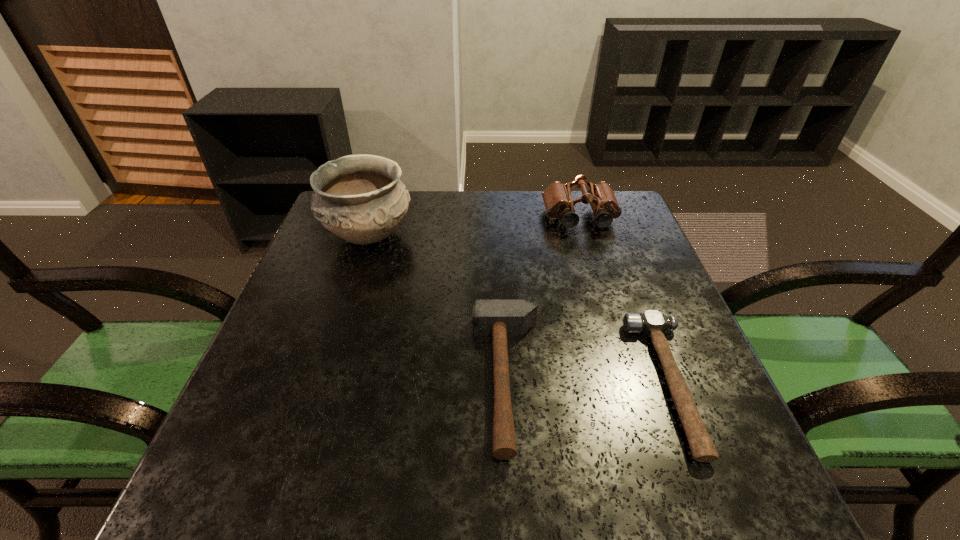
Image resolution: width=960 pixels, height=540 pixels. Find the location of `vacant area between the shorter hammer and the binoculars`. vacant area between the shorter hammer and the binoculars is located at coordinates (625, 300).

The image size is (960, 540). I want to click on vacant space that is in between the shortest object and the left hammer, so click(588, 381).

Where is `free space between the taller hammer and the binoculars`? The image size is (960, 540). free space between the taller hammer and the binoculars is located at coordinates (543, 299).

Locate an element on the screen. This screenshot has height=540, width=960. empty space between the binoculars and the third object from right to left is located at coordinates pos(543,299).

Where is `vacant space in between the shorter hammer and the third tallest object`? This screenshot has width=960, height=540. vacant space in between the shorter hammer and the third tallest object is located at coordinates (588, 381).

At what (x,y) coordinates should I click in order to perform the action: click on unoccupied position between the third tallest object and the binoculars. Please return your answer as a coordinate pair (x, y). The width and height of the screenshot is (960, 540). Looking at the image, I should click on (543, 299).

Locate an element on the screen. vacant area between the taller hammer and the second tallest object is located at coordinates pos(543,299).

In order to click on object that can be found as the closest to the left hammer in this screenshot , I will do `click(652, 322)`.

Select which object is the third closest to the binoculars. Please provide its 2D coordinates. Your answer should be formatted as a tuple, i.e. [(x, y)], where the tuple contains the x and y coordinates of a point satisfying the conditions above.

[(360, 198)]

The width and height of the screenshot is (960, 540). What are the coordinates of `vacant space that satisfies the following two spatial constraints: 1. through the eyepieces of the second tallest object; 2. on the striking surface of the second shortest object` in the screenshot? It's located at (630, 380).